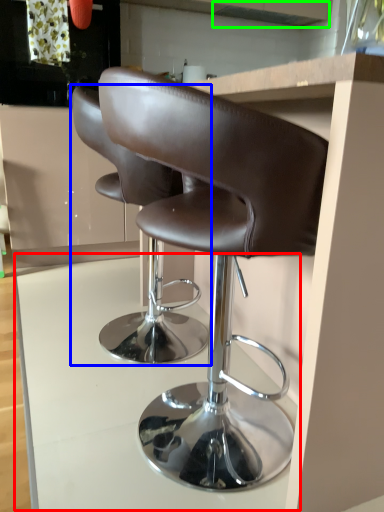
Question: Considering the real-world distances, which object is farthest from table (highlighted by a red box)? chair (highlighted by a blue box) or exhaust hood (highlighted by a green box)?

Choices:
 (A) chair
 (B) exhaust hood

Answer: (B)